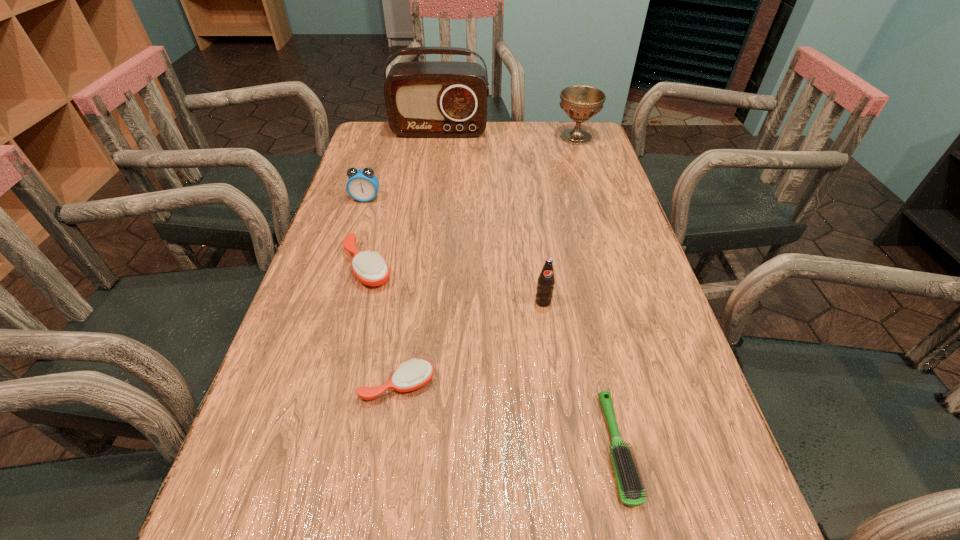
Where is `the fifth closest object relative to the shortest hairbrush`? the fifth closest object relative to the shortest hairbrush is located at coordinates (580, 103).

Select which object is the sixth closest to the shortest object. Please provide its 2D coordinates. Your answer should be formatted as a tuple, i.e. [(x, y)], where the tuple contains the x and y coordinates of a point satisfying the conditions above.

[(427, 99)]

This screenshot has width=960, height=540. In order to click on hairbrush that is the closest to the smaller orange hairbrush in this screenshot , I will do `click(371, 269)`.

Where is `hairbrush that stands as the third closest to the alarm clock`? This screenshot has height=540, width=960. hairbrush that stands as the third closest to the alarm clock is located at coordinates 629,485.

The height and width of the screenshot is (540, 960). I want to click on vacant region that satisfies the following two spatial constraints: 1. on the face of the third farthest object; 2. on the right side of the shortest hairbrush, so click(x=288, y=448).